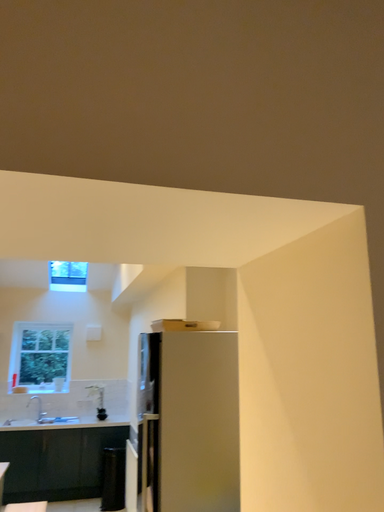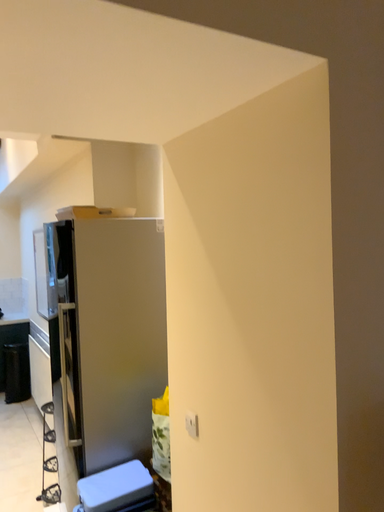
Question: Which way did the camera rotate in the video?

Choices:
 (A) rotated right
 (B) rotated left

Answer: (A)